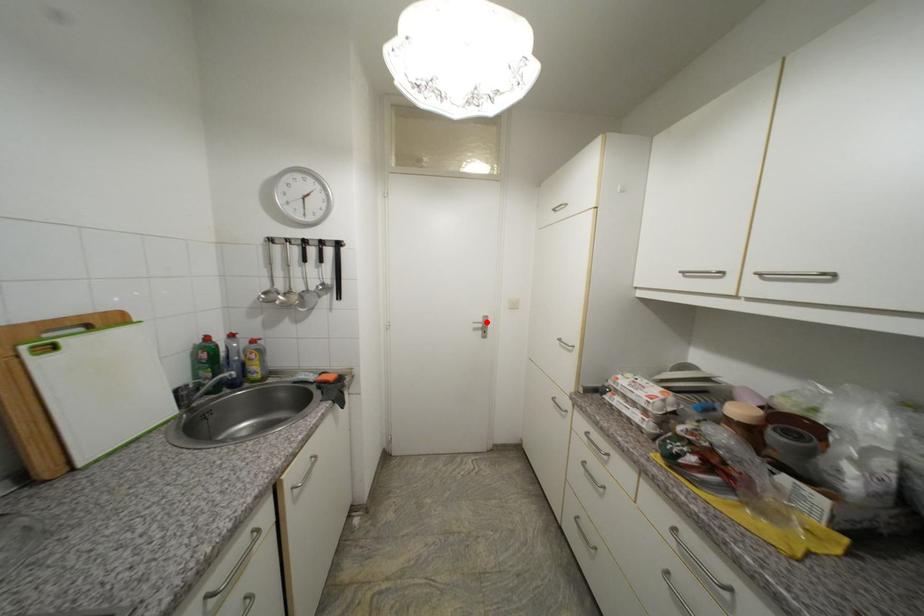
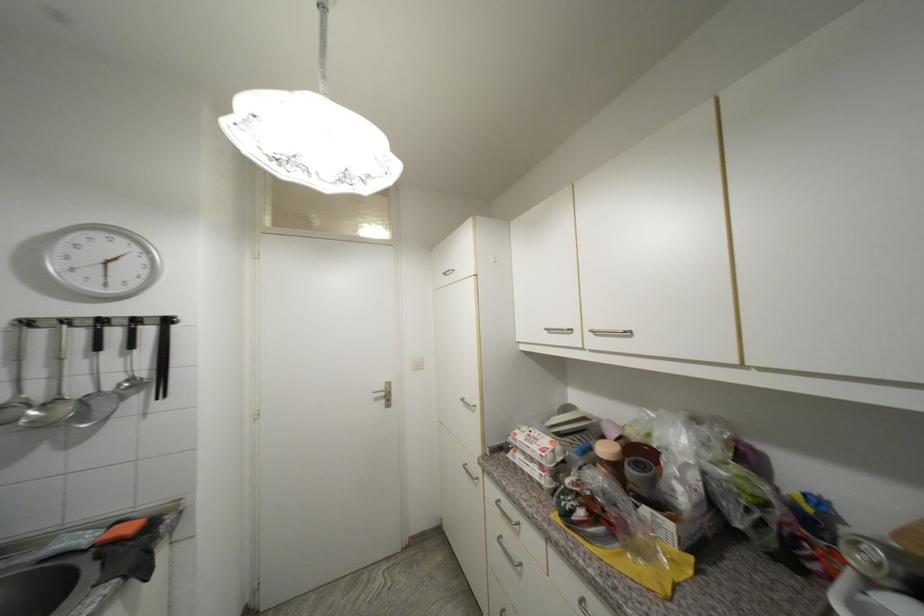
Locate, in the second image, the point that corresponds to the highlighted location in the first image.

(388, 390)